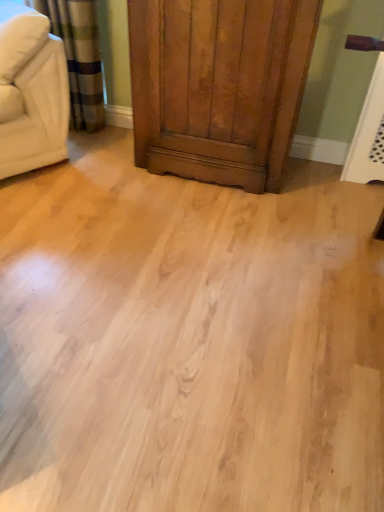
Where is `light wood floor at center`? The image size is (384, 512). light wood floor at center is located at coordinates (188, 340).

This screenshot has height=512, width=384. Describe the element at coordinates (31, 91) in the screenshot. I see `beige fabric couch at upper left` at that location.

Measure the distance between shiny brown wood dresser at center and camera.

A distance of 1.51 meters exists between shiny brown wood dresser at center and camera.

What is the approximate height of shiny brown wood dresser at center?

shiny brown wood dresser at center is 32.83 inches in height.

At what (x,y) coordinates should I click in order to perform the action: click on light wood floor at center. Please return your answer as a coordinate pair (x, y). Looking at the image, I should click on (188, 340).

Based on the photo, from a real-world perspective, is shiny brown wood dresser at center physically located above or below beige fabric couch at upper left?

In terms of real-world spatial position, shiny brown wood dresser at center is below beige fabric couch at upper left.

Considering the relative positions of shiny brown wood dresser at center and beige fabric couch at upper left in the image provided, is shiny brown wood dresser at center to the right of beige fabric couch at upper left from the viewer's perspective?

Yes, shiny brown wood dresser at center is to the right of beige fabric couch at upper left.

Are shiny brown wood dresser at center and beige fabric couch at upper left making contact?

shiny brown wood dresser at center is not next to beige fabric couch at upper left, and they're not touching.

Does shiny brown wood dresser at center have a greater height compared to beige fabric couch at upper left?

Indeed, shiny brown wood dresser at center has a greater height compared to beige fabric couch at upper left.

Which object is closer to the camera taking this photo, beige fabric couch at upper left or shiny brown wood dresser at center?

shiny brown wood dresser at center is more forward.

Are beige fabric couch at upper left and shiny brown wood dresser at center far apart?

They are positioned close to each other.

Which is behind, point (48, 71) or point (148, 75)?

Positioned behind is point (148, 75).

Can shiny brown wood dresser at center be found inside beige fabric couch at upper left?

That's incorrect, shiny brown wood dresser at center is not inside beige fabric couch at upper left.

Is light wood floor at center facing towards beige fabric couch at upper left?

No, light wood floor at center does not turn towards beige fabric couch at upper left.

The width and height of the screenshot is (384, 512). Identify the location of furniture behind the light wood floor at center. (31, 91).

Can you confirm if light wood floor at center is positioned to the left of beige fabric couch at upper left?

Incorrect, light wood floor at center is not on the left side of beige fabric couch at upper left.

How many degrees apart are the facing directions of light wood floor at center and beige fabric couch at upper left?

The facing directions of light wood floor at center and beige fabric couch at upper left are 126 degrees apart.

Considering the sizes of shiny brown wood dresser at center and light wood floor at center in the image, is shiny brown wood dresser at center wider or thinner than light wood floor at center?

Clearly, shiny brown wood dresser at center has less width compared to light wood floor at center.

Is shiny brown wood dresser at center in contact with light wood floor at center?

No, shiny brown wood dresser at center is not touching light wood floor at center.

Between shiny brown wood dresser at center and light wood floor at center, which one appears on the left side from the viewer's perspective?

Positioned to the left is light wood floor at center.

Can you confirm if shiny brown wood dresser at center is smaller than light wood floor at center?

Actually, shiny brown wood dresser at center might be larger than light wood floor at center.

Which is closer, [189,344] or [289,47]?

The point [189,344] is closer.

Considering the sizes of objects light wood floor at center and shiny brown wood dresser at center in the image provided, who is bigger, light wood floor at center or shiny brown wood dresser at center?

shiny brown wood dresser at center.

Considering the positions of objects light wood floor at center and shiny brown wood dresser at center in the image provided, who is behind, light wood floor at center or shiny brown wood dresser at center?

Positioned behind is shiny brown wood dresser at center.

The height and width of the screenshot is (512, 384). What are the coordinates of `plain lying on the left of shiny brown wood dresser at center` in the screenshot? It's located at (188, 340).

Is beige fabric couch at upper left far from light wood floor at center?

That's not correct — beige fabric couch at upper left is a little close to light wood floor at center.

Between beige fabric couch at upper left and light wood floor at center, which one has larger size?

light wood floor at center.

Consider the image. Choose the correct answer: Is beige fabric couch at upper left inside light wood floor at center or outside it?

beige fabric couch at upper left cannot be found inside light wood floor at center.

Find the location of a particular element. This screenshot has width=384, height=512. dresser on the right of beige fabric couch at upper left is located at coordinates (214, 138).

I want to click on furniture behind the shiny brown wood dresser at center, so click(31, 91).

When comparing their distances from beige fabric couch at upper left, does shiny brown wood dresser at center or light wood floor at center seem further?

light wood floor at center lies further to beige fabric couch at upper left than the other object.

Looking at the image, which one is located closer to shiny brown wood dresser at center, beige fabric couch at upper left or light wood floor at center?

beige fabric couch at upper left is closer to shiny brown wood dresser at center.

Based on their spatial positions, is beige fabric couch at upper left or shiny brown wood dresser at center closer to light wood floor at center?

Based on the image, shiny brown wood dresser at center appears to be nearer to light wood floor at center.

Estimate the real-world distances between objects in this image. Which object is closer to light wood floor at center, shiny brown wood dresser at center or beige fabric couch at upper left?

Among the two, shiny brown wood dresser at center is located nearer to light wood floor at center.

Estimate the real-world distances between objects in this image. Which object is further from beige fabric couch at upper left, light wood floor at center or shiny brown wood dresser at center?

light wood floor at center.

Looking at the image, which one is located further to shiny brown wood dresser at center, light wood floor at center or beige fabric couch at upper left?

Among the two, light wood floor at center is located further to shiny brown wood dresser at center.

The height and width of the screenshot is (512, 384). I want to click on dresser between beige fabric couch at upper left and light wood floor at center in the up-down direction, so click(x=214, y=138).